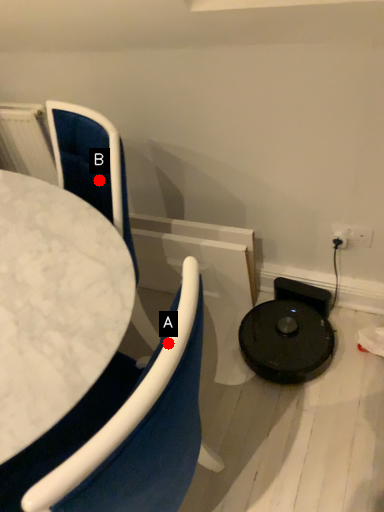
Question: Two points are circled on the image, labeled by A and B beside each circle. Which point is farther to the camera?

Choices:
 (A) A is further
 (B) B is further

Answer: (B)